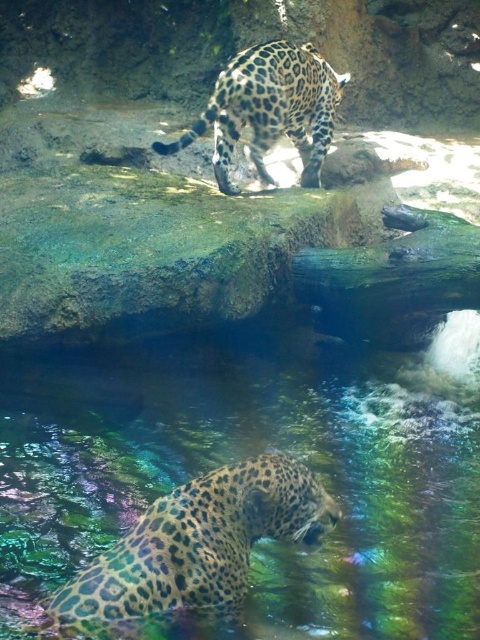
Question: Can you confirm if translucent glass water at center is smaller than spotted fur jaguar at upper center?

Choices:
 (A) no
 (B) yes

Answer: (A)

Question: Among these objects, which one is nearest to the camera?

Choices:
 (A) spotted fur jaguar at lower left
 (B) translucent glass water at center
 (C) spotted fur jaguar at upper center

Answer: (A)

Question: Can you confirm if translucent glass water at center is positioned to the right of spotted fur jaguar at upper center?

Choices:
 (A) no
 (B) yes

Answer: (A)

Question: Among these objects, which one is farthest from the camera?

Choices:
 (A) spotted fur jaguar at upper center
 (B) translucent glass water at center
 (C) spotted fur jaguar at lower left

Answer: (A)

Question: Observing the image, what is the correct spatial positioning of translucent glass water at center in reference to spotted fur jaguar at upper center?

Choices:
 (A) above
 (B) below

Answer: (B)

Question: Which point is farther from the camera taking this photo?

Choices:
 (A) (448, 611)
 (B) (217, 102)

Answer: (B)